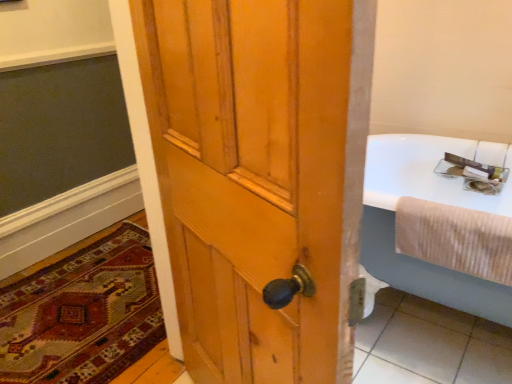
Question: From the image's perspective, does carpeted rug at lower left appear lower than beige ribbed towel at right?

Choices:
 (A) yes
 (B) no

Answer: (A)

Question: From the image's perspective, is carpeted rug at lower left above beige ribbed towel at right?

Choices:
 (A) no
 (B) yes

Answer: (A)

Question: Would you say carpeted rug at lower left is a long distance from beige ribbed towel at right?

Choices:
 (A) no
 (B) yes

Answer: (B)

Question: Does carpeted rug at lower left lie behind beige ribbed towel at right?

Choices:
 (A) no
 (B) yes

Answer: (B)

Question: Is carpeted rug at lower left shorter than beige ribbed towel at right?

Choices:
 (A) no
 (B) yes

Answer: (B)

Question: Can we say carpeted rug at lower left lies outside beige ribbed towel at right?

Choices:
 (A) no
 (B) yes

Answer: (B)

Question: Are beige ribbed towel at right and carpeted rug at lower left located far from each other?

Choices:
 (A) no
 (B) yes

Answer: (B)

Question: From a real-world perspective, is beige ribbed towel at right under carpeted rug at lower left?

Choices:
 (A) no
 (B) yes

Answer: (A)

Question: Is beige ribbed towel at right at the left side of carpeted rug at lower left?

Choices:
 (A) no
 (B) yes

Answer: (A)

Question: Is beige ribbed towel at right smaller than carpeted rug at lower left?

Choices:
 (A) no
 (B) yes

Answer: (B)

Question: Does beige ribbed towel at right lie in front of carpeted rug at lower left?

Choices:
 (A) yes
 (B) no

Answer: (A)

Question: Is beige ribbed towel at right directly adjacent to carpeted rug at lower left?

Choices:
 (A) yes
 (B) no

Answer: (B)

Question: Considering their positions, is beige ribbed towel at right located in front of or behind carpeted rug at lower left?

Choices:
 (A) behind
 (B) front

Answer: (B)